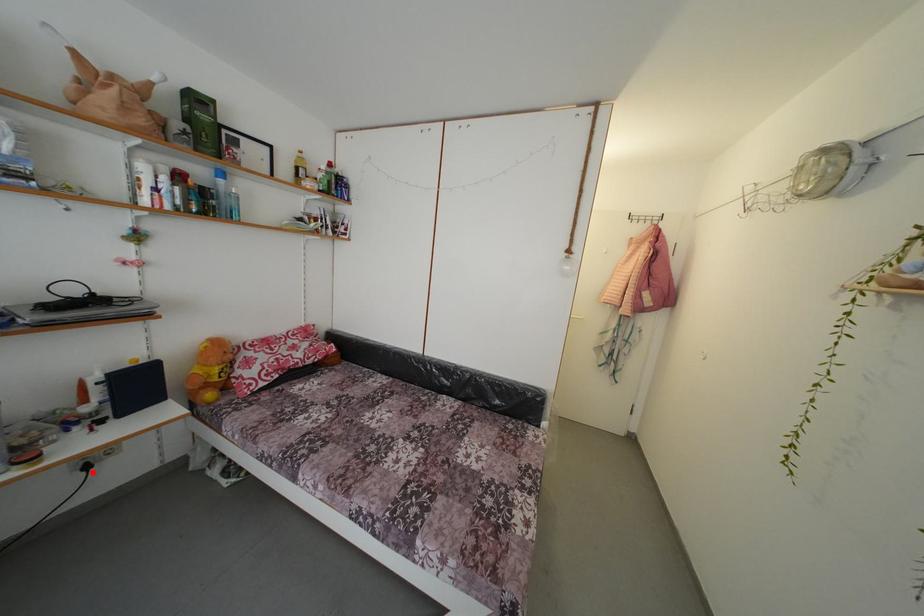
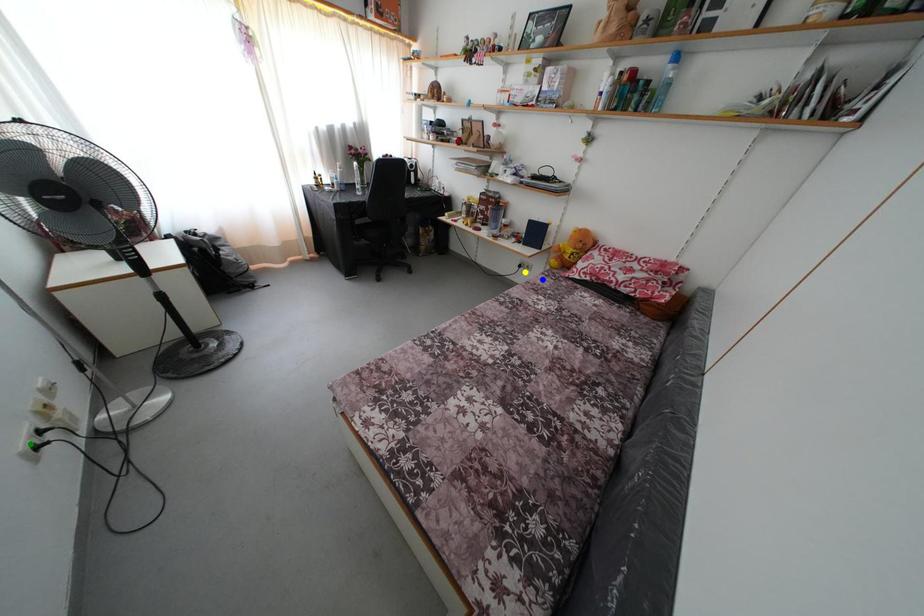
Question: I am providing you with two images of the same scene from different viewpoints. A red point is marked on the first image. You are given multiple points on the second image. Which point in image 2 represents the same 3d spot as the red point in image 1?

Choices:
 (A) yellow point
 (B) blue point
 (C) green point

Answer: (A)